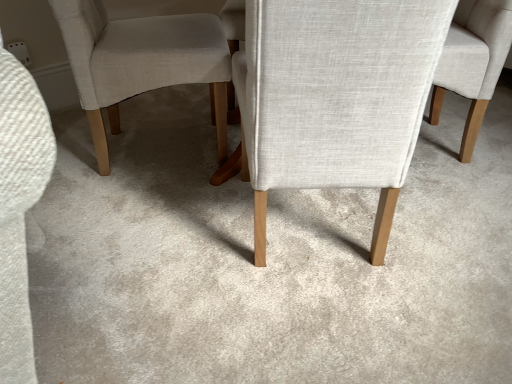
Question: Would you say light beige fabric chair at center, the first chair viewed from the right, is to the left or to the right of light beige fabric chair at center, positioned as the first chair in left-to-right order, in the picture?

Choices:
 (A) right
 (B) left

Answer: (A)

Question: From a real-world perspective, is light beige fabric chair at center, the first chair viewed from the right, above or below light beige fabric chair at center, positioned as the first chair in left-to-right order?

Choices:
 (A) below
 (B) above

Answer: (A)

Question: In terms of size, does light beige fabric chair at center, the 2th chair from the left, appear bigger or smaller than light beige fabric chair at center, which is counted as the 2th chair, starting from the right?

Choices:
 (A) big
 (B) small

Answer: (B)

Question: From the image's perspective, is light beige fabric chair at center, positioned as the first chair in left-to-right order, positioned above or below light beige fabric chair at center, the first chair viewed from the right?

Choices:
 (A) below
 (B) above

Answer: (A)

Question: In terms of size, does light beige fabric chair at center, which is counted as the 2th chair, starting from the right, appear bigger or smaller than light beige fabric chair at center, the 2th chair from the left?

Choices:
 (A) big
 (B) small

Answer: (A)

Question: Considering the positions of point (316, 64) and point (489, 8), is point (316, 64) closer or farther from the camera than point (489, 8)?

Choices:
 (A) closer
 (B) farther

Answer: (A)

Question: Looking at their shapes, would you say light beige fabric chair at center, positioned as the first chair in left-to-right order, is wider or thinner than light beige fabric chair at center, the first chair viewed from the right?

Choices:
 (A) wide
 (B) thin

Answer: (A)